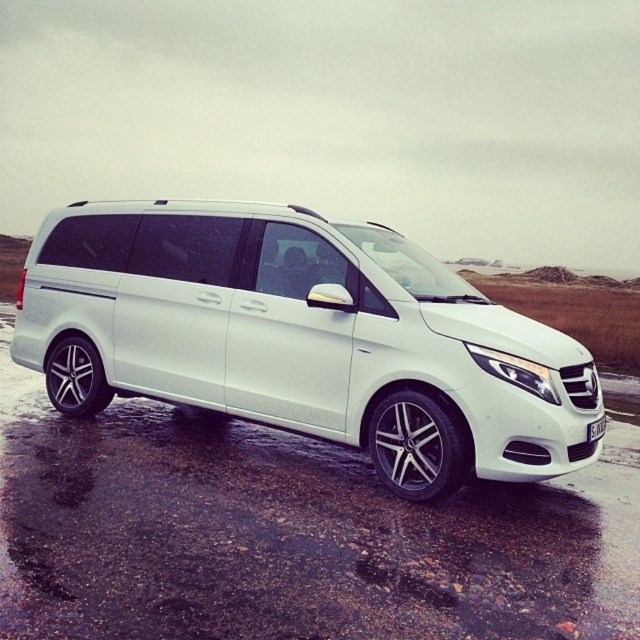
Does white metallic van at center have a lesser height compared to white plastic license plate at lower right?

No, white metallic van at center is not shorter than white plastic license plate at lower right.

Between white metallic van at center and white plastic license plate at lower right, which one is positioned higher?

white metallic van at center is above.

Is point (448, 355) more distant than point (595, 440)?

No, (448, 355) is in front of (595, 440).

I want to click on white metallic van at center, so click(x=301, y=337).